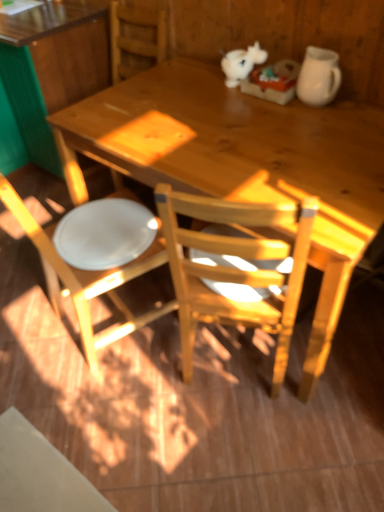
Question: Is the surface of wooden desk at upper left, which is the second desk in right-to-left order, in direct contact with white matte unicorn at upper center?

Choices:
 (A) yes
 (B) no

Answer: (B)

Question: From the image's perspective, would you say wooden desk at upper left, which is the second desk in right-to-left order, is shown under white matte unicorn at upper center?

Choices:
 (A) yes
 (B) no

Answer: (B)

Question: Is wooden desk at upper left, placed as the 1th desk when sorted from left to right, positioned in front of white matte unicorn at upper center?

Choices:
 (A) yes
 (B) no

Answer: (B)

Question: From the image's perspective, is wooden desk at upper left, placed as the 1th desk when sorted from left to right, above white matte unicorn at upper center?

Choices:
 (A) yes
 (B) no

Answer: (A)

Question: Can you confirm if wooden desk at upper left, placed as the 1th desk when sorted from left to right, is thinner than white matte unicorn at upper center?

Choices:
 (A) yes
 (B) no

Answer: (B)

Question: From a real-world perspective, is wooden desk at upper left, placed as the 1th desk when sorted from left to right, beneath white matte unicorn at upper center?

Choices:
 (A) yes
 (B) no

Answer: (A)

Question: From a real-world perspective, is wooden desk at center, which is the second desk from left to right, over white glossy plate at lower left?

Choices:
 (A) no
 (B) yes

Answer: (A)

Question: Can you confirm if wooden desk at center, which is the second desk from left to right, is thinner than white glossy plate at lower left?

Choices:
 (A) yes
 (B) no

Answer: (B)

Question: Would you say wooden desk at center, marked as the first desk in a right-to-left arrangement, is outside white glossy plate at lower left?

Choices:
 (A) no
 (B) yes

Answer: (B)

Question: Considering the relative sizes of wooden desk at center, marked as the first desk in a right-to-left arrangement, and white glossy plate at lower left in the image provided, is wooden desk at center, marked as the first desk in a right-to-left arrangement, shorter than white glossy plate at lower left?

Choices:
 (A) no
 (B) yes

Answer: (A)

Question: Does wooden desk at center, which is the second desk from left to right, have a greater width compared to white glossy plate at lower left?

Choices:
 (A) no
 (B) yes

Answer: (B)

Question: Can you confirm if wooden desk at center, which is the second desk from left to right, is positioned to the left of white glossy plate at lower left?

Choices:
 (A) yes
 (B) no

Answer: (B)

Question: Considering the relative positions of wooden desk at upper left, placed as the 1th desk when sorted from left to right, and white matte chair at left in the image provided, is wooden desk at upper left, placed as the 1th desk when sorted from left to right, to the left of white matte chair at left from the viewer's perspective?

Choices:
 (A) no
 (B) yes

Answer: (B)